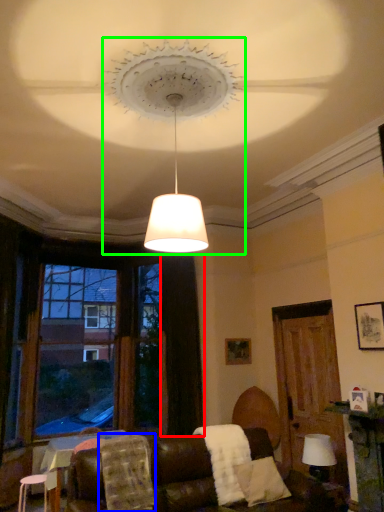
Question: Which object is the farthest from curtain (highlighted by a red box)? Choose among these: blanket (highlighted by a blue box) or lighting (highlighted by a green box).

Choices:
 (A) blanket
 (B) lighting

Answer: (B)